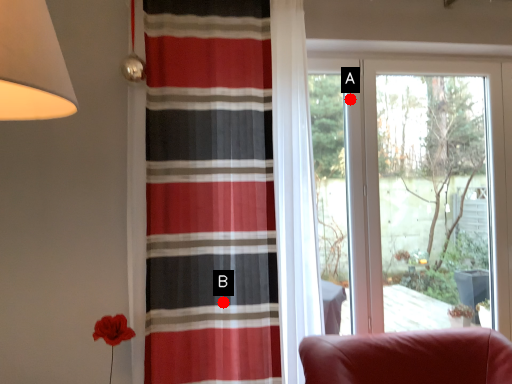
Question: Two points are circled on the image, labeled by A and B beside each circle. Which point is closer to the camera?

Choices:
 (A) A is closer
 (B) B is closer

Answer: (B)